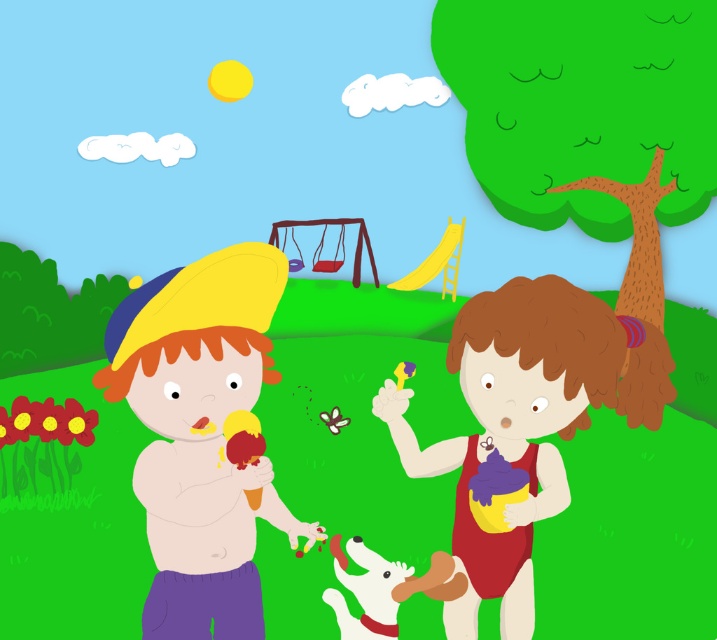
From the picture: Can you confirm if smooth yellow hat at left is positioned to the left of matte yellow swimsuit at center?

Yes, smooth yellow hat at left is to the left of matte yellow swimsuit at center.

Consider the image. Is smooth yellow hat at left bigger than matte yellow swimsuit at center?

Incorrect, smooth yellow hat at left is not larger than matte yellow swimsuit at center.

Is point (213, 595) closer to camera compared to point (457, 353)?

Yes, it is in front of point (457, 353).

Locate an element on the screen. The height and width of the screenshot is (640, 717). smooth yellow hat at left is located at coordinates (201, 435).